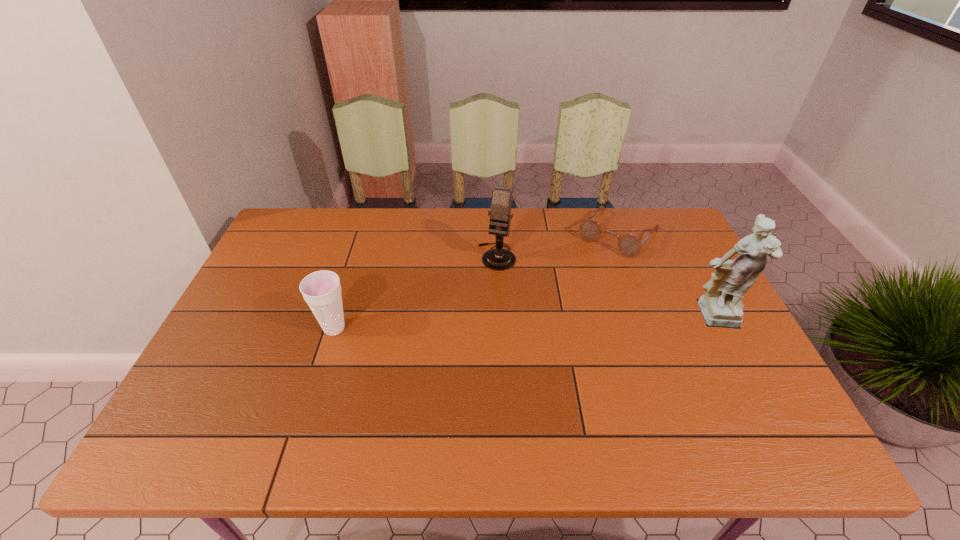
The image size is (960, 540). In order to click on vacant space situated on the front-facing side of the microphone in this screenshot , I will do `click(482, 300)`.

The image size is (960, 540). Find the location of `free space located on the front-facing side of the shortest object`. free space located on the front-facing side of the shortest object is located at coordinates (548, 319).

Identify the location of vacant space located 0.350m on the front-facing side of the shortest object. The image size is (960, 540). (544, 323).

Identify the location of vacant space situated 0.300m on the front-facing side of the shortest object. (553, 312).

Locate an element on the screen. This screenshot has width=960, height=540. microphone present at the far edge is located at coordinates (499, 259).

Where is `spectacles that is at the far edge`? The width and height of the screenshot is (960, 540). spectacles that is at the far edge is located at coordinates (629, 245).

I want to click on figurine present at the right edge, so click(x=721, y=306).

At what (x,y) coordinates should I click in order to perform the action: click on spectacles that is at the right edge. Please return your answer as a coordinate pair (x, y). The width and height of the screenshot is (960, 540). Looking at the image, I should click on (629, 245).

In order to click on object at the far right corner in this screenshot , I will do `click(629, 245)`.

Where is `vacant region at the far edge of the desktop`? This screenshot has width=960, height=540. vacant region at the far edge of the desktop is located at coordinates (473, 243).